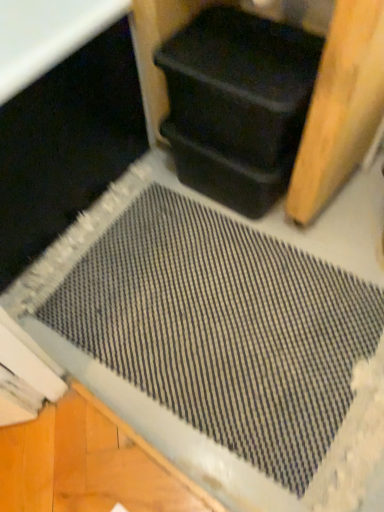
Question: In the image, is black plastic container at upper center positioned in front of or behind black plastic container at upper right?

Choices:
 (A) behind
 (B) front

Answer: (B)

Question: Which is correct: black plastic container at upper center is inside black plastic container at upper right, or outside of it?

Choices:
 (A) outside
 (B) inside

Answer: (A)

Question: From a real-world perspective, is black plastic container at upper center above or below black plastic container at upper right?

Choices:
 (A) below
 (B) above

Answer: (A)

Question: Based on their positions, is black plastic container at upper right located to the left or right of black plastic container at upper center?

Choices:
 (A) right
 (B) left

Answer: (B)

Question: From the image's perspective, relative to black plastic container at upper center, is black plastic container at upper right above or below?

Choices:
 (A) above
 (B) below

Answer: (B)

Question: From a real-world perspective, is black plastic container at upper right above or below black plastic container at upper center?

Choices:
 (A) below
 (B) above

Answer: (B)

Question: Considering the positions of point (296, 64) and point (180, 81), is point (296, 64) closer or farther from the camera than point (180, 81)?

Choices:
 (A) closer
 (B) farther

Answer: (A)